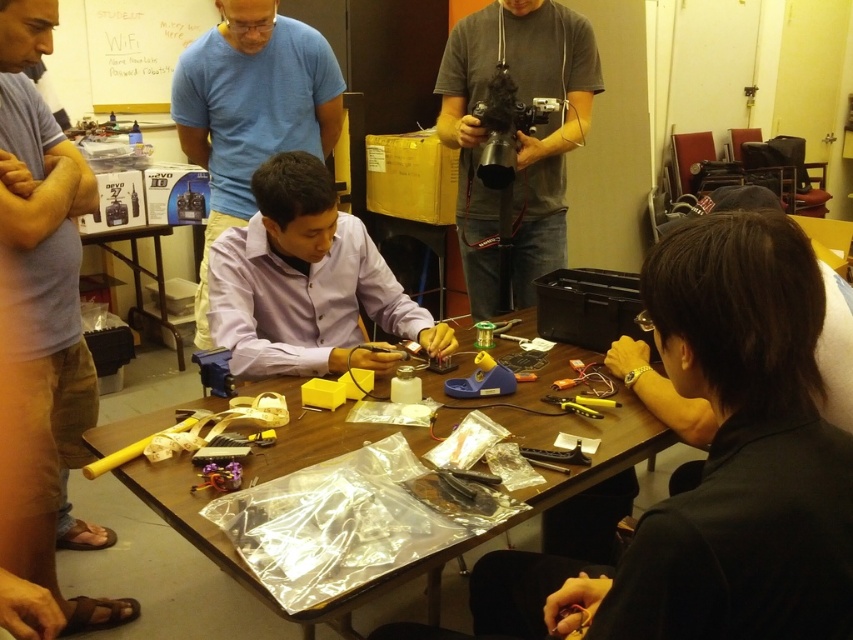
What object is located at the coordinates point (x=515, y=138)?

The gray matte camera at upper center is located at point (x=515, y=138).

You are organizing a workshop and need to place a large electronic device on the table. Which table, the wooden table at center or the black plastic table at lower left, can accommodate the device based on their sizes?

The wooden table at center has a larger width than the black plastic table at lower left, so the wooden table at center can accommodate the large electronic device.